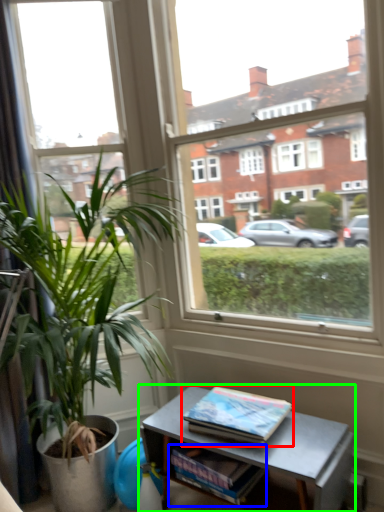
Question: Which object is the farthest from book (highlighted by a red box)? Choose among these: magazine (highlighted by a blue box) or table (highlighted by a green box).

Choices:
 (A) magazine
 (B) table

Answer: (A)